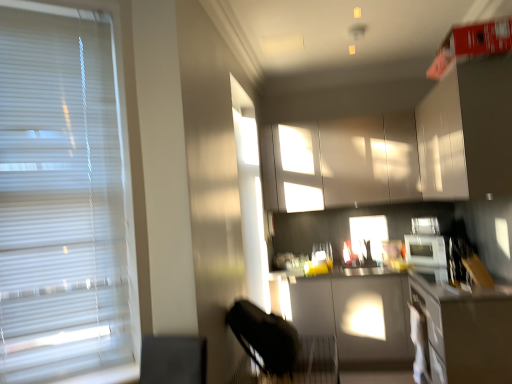
Question: Which direction should I rotate to face white glossy cabinets at upper center, acting as the 1th cabinetry starting from the back, — up or down?

Choices:
 (A) up
 (B) down

Answer: (A)

Question: Considering the relative positions of white blinds at left and white glossy cabinets at upper center, acting as the 1th cabinetry starting from the back, in the image provided, is white blinds at left behind white glossy cabinets at upper center, acting as the 1th cabinetry starting from the back,?

Choices:
 (A) no
 (B) yes

Answer: (A)

Question: Is white blinds at left far away from white glossy cabinets at upper center, acting as the 1th cabinetry starting from the back?

Choices:
 (A) yes
 (B) no

Answer: (A)

Question: Is white blinds at left to the right of white glossy cabinets at upper center, acting as the 1th cabinetry starting from the back, from the viewer's perspective?

Choices:
 (A) no
 (B) yes

Answer: (A)

Question: Is white blinds at left thinner than white glossy cabinets at upper center, the second cabinetry in the front-to-back sequence?

Choices:
 (A) no
 (B) yes

Answer: (B)

Question: Is white blinds at left taller than white glossy cabinets at upper center, acting as the 1th cabinetry starting from the back?

Choices:
 (A) yes
 (B) no

Answer: (A)

Question: Is white blinds at left positioned beyond the bounds of white glossy cabinets at upper center, acting as the 1th cabinetry starting from the back?

Choices:
 (A) no
 (B) yes

Answer: (B)

Question: From the image's perspective, is white glossy cabinets at upper center, the second cabinetry in the front-to-back sequence, below smooth gray countertop at lower right, arranged as the 1th counter top when ordered from the bottom?

Choices:
 (A) no
 (B) yes

Answer: (A)

Question: From a real-world perspective, is white glossy cabinets at upper center, acting as the 1th cabinetry starting from the back, physically above smooth gray countertop at lower right, arranged as the 2th counter top when viewed from the back?

Choices:
 (A) no
 (B) yes

Answer: (B)

Question: From a real-world perspective, does white glossy cabinets at upper center, the second cabinetry in the front-to-back sequence, sit lower than smooth gray countertop at lower right, arranged as the first counter top when viewed from the front?

Choices:
 (A) yes
 (B) no

Answer: (B)

Question: From the image's perspective, would you say white glossy cabinets at upper center, the second cabinetry in the front-to-back sequence, is positioned over smooth gray countertop at lower right, arranged as the 2th counter top when viewed from the back?

Choices:
 (A) yes
 (B) no

Answer: (A)

Question: Does white glossy cabinets at upper center, the second cabinetry in the front-to-back sequence, touch smooth gray countertop at lower right, arranged as the first counter top when viewed from the front?

Choices:
 (A) no
 (B) yes

Answer: (A)

Question: Does white glossy cabinets at upper center, acting as the 1th cabinetry starting from the back, have a smaller size compared to smooth gray countertop at lower right, arranged as the 2th counter top when viewed from the back?

Choices:
 (A) no
 (B) yes

Answer: (A)

Question: Could you tell me if white glossy cabinets at upper center, acting as the 1th cabinetry starting from the back, is facing matte gray countertop at center, which ranks as the first counter top in back-to-front order?

Choices:
 (A) yes
 (B) no

Answer: (B)